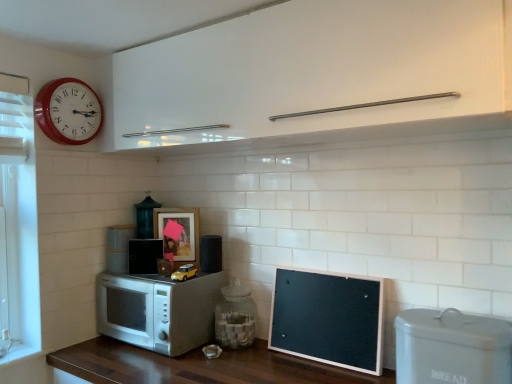
Where is `empty space that is ontop of white glossy cabinet at upper center`? empty space that is ontop of white glossy cabinet at upper center is located at coordinates coord(199,24).